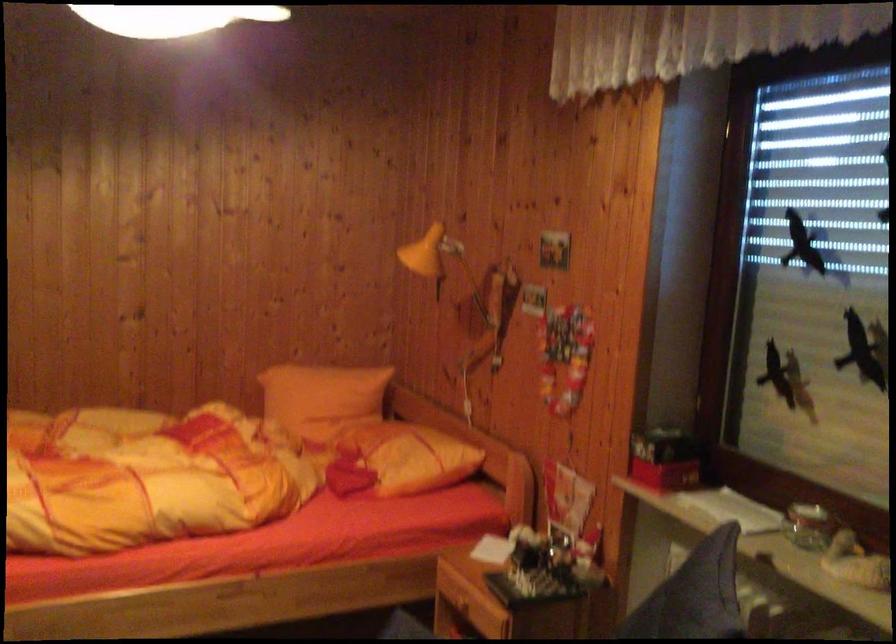
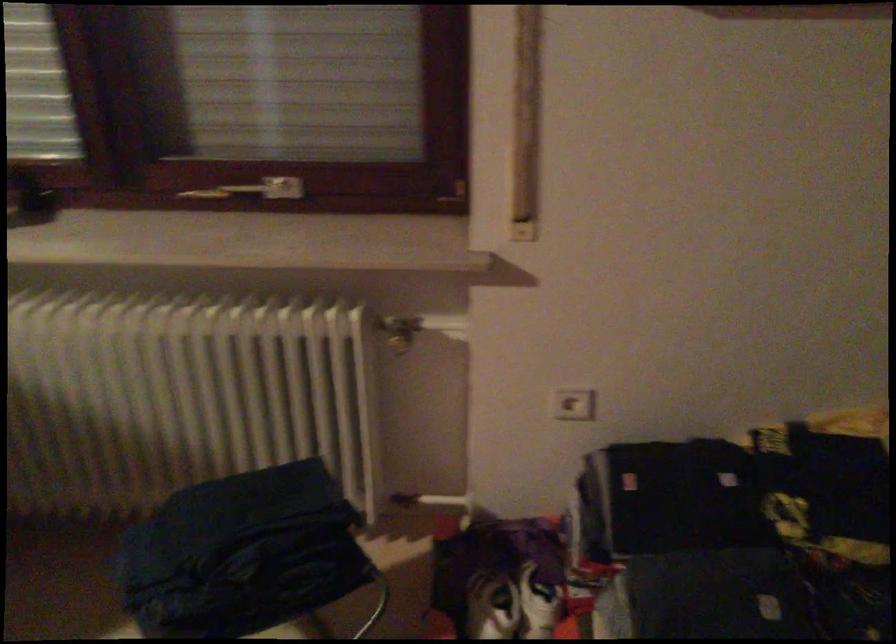
The images are taken continuously from a first-person perspective. In which direction is your viewpoint rotating?

The rotation direction of the camera is right-down.